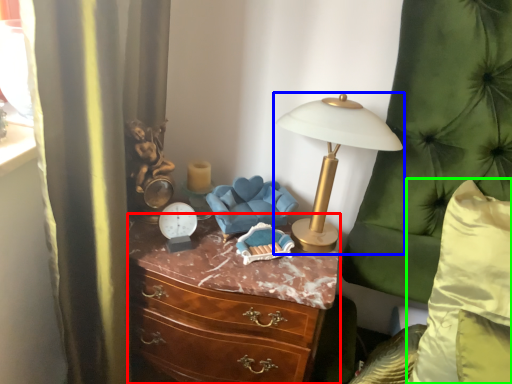
Question: Which object is positioned closest to chest of drawers (highlighted by a red box)? Select from lamp (highlighted by a blue box) and pillow (highlighted by a green box).

Choices:
 (A) lamp
 (B) pillow

Answer: (A)